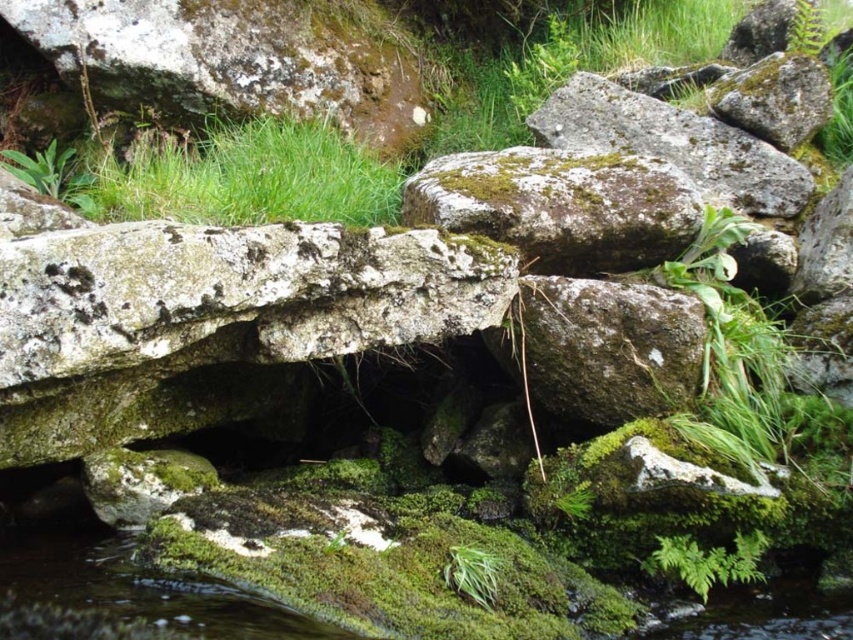
Does green mossy rock at center-right have a larger size compared to green leafy fern at lower right?

Correct, green mossy rock at center-right is larger in size than green leafy fern at lower right.

Consider the image. Is green mossy rock at center-right to the right of green leafy fern at lower right from the viewer's perspective?

Correct, you'll find green mossy rock at center-right to the right of green leafy fern at lower right.

Is point (780, 188) positioned before point (706, 548)?

That is False.

This screenshot has height=640, width=853. I want to click on green mossy rock at center-right, so click(x=674, y=145).

Is green mossy rock at center positioned at the back of green leafy fern at lower right?

Yes, it is behind green leafy fern at lower right.

Does green mossy rock at center have a larger size compared to green leafy fern at lower right?

Yes, green mossy rock at center is bigger than green leafy fern at lower right.

Is point (426, 186) farther from viewer compared to point (746, 548)?

Yes, it is behind point (746, 548).

Where is `green mossy rock at center`? green mossy rock at center is located at coordinates (560, 205).

Can you confirm if mossy stone at upper left is taller than green mossy rock at center?

Indeed, mossy stone at upper left has a greater height compared to green mossy rock at center.

Where is `mossy stone at upper left`? mossy stone at upper left is located at coordinates (239, 60).